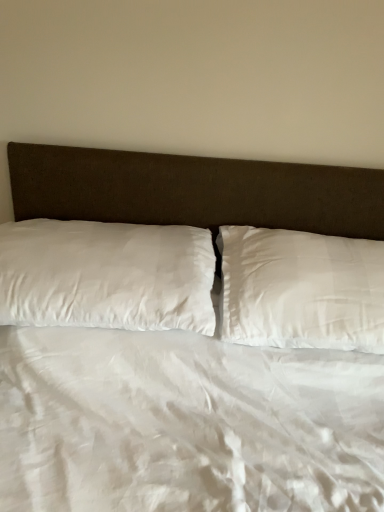
Question: From a real-world perspective, is white satin pillow at left, which appears as the 2th pillow when viewed from the right, positioned over white satin pillow at center, placed as the 1th pillow when sorted from right to left, based on gravity?

Choices:
 (A) no
 (B) yes

Answer: (A)

Question: Is white satin pillow at left, which appears as the 2th pillow when viewed from the right, looking in the opposite direction of white satin pillow at center, positioned as the 2th pillow in left-to-right order?

Choices:
 (A) no
 (B) yes

Answer: (A)

Question: Is white satin pillow at left, arranged as the 1th pillow when viewed from the left, behind white satin pillow at center, positioned as the 2th pillow in left-to-right order?

Choices:
 (A) no
 (B) yes

Answer: (A)

Question: From the image's perspective, does white satin pillow at left, arranged as the 1th pillow when viewed from the left, appear higher than white satin pillow at center, placed as the 1th pillow when sorted from right to left?

Choices:
 (A) yes
 (B) no

Answer: (A)

Question: Is the depth of white satin pillow at left, which appears as the 2th pillow when viewed from the right, less than that of white satin pillow at center, positioned as the 2th pillow in left-to-right order?

Choices:
 (A) yes
 (B) no

Answer: (A)

Question: Does white satin pillow at left, arranged as the 1th pillow when viewed from the left, have a lesser width compared to white satin pillow at center, positioned as the 2th pillow in left-to-right order?

Choices:
 (A) yes
 (B) no

Answer: (B)

Question: Considering the relative positions of white satin pillow at center, positioned as the 2th pillow in left-to-right order, and white satin pillow at left, arranged as the 1th pillow when viewed from the left, in the image provided, is white satin pillow at center, positioned as the 2th pillow in left-to-right order, behind white satin pillow at left, arranged as the 1th pillow when viewed from the left,?

Choices:
 (A) no
 (B) yes

Answer: (B)

Question: From the image's perspective, would you say white satin pillow at center, placed as the 1th pillow when sorted from right to left, is shown under white satin pillow at left, arranged as the 1th pillow when viewed from the left?

Choices:
 (A) yes
 (B) no

Answer: (A)

Question: Is white satin pillow at center, placed as the 1th pillow when sorted from right to left, closer to camera compared to white satin pillow at left, which appears as the 2th pillow when viewed from the right?

Choices:
 (A) yes
 (B) no

Answer: (B)

Question: Would you say white satin pillow at left, which appears as the 2th pillow when viewed from the right, is part of white satin pillow at center, positioned as the 2th pillow in left-to-right order,'s contents?

Choices:
 (A) yes
 (B) no

Answer: (B)

Question: Is white satin pillow at center, placed as the 1th pillow when sorted from right to left, placed right next to white satin pillow at left, which appears as the 2th pillow when viewed from the right?

Choices:
 (A) no
 (B) yes

Answer: (A)

Question: Can you confirm if white satin pillow at center, placed as the 1th pillow when sorted from right to left, is bigger than white satin pillow at left, arranged as the 1th pillow when viewed from the left?

Choices:
 (A) no
 (B) yes

Answer: (A)

Question: From a real-world perspective, is white satin pillow at left, which appears as the 2th pillow when viewed from the right, positioned above or below white satin pillow at center, positioned as the 2th pillow in left-to-right order?

Choices:
 (A) below
 (B) above

Answer: (A)